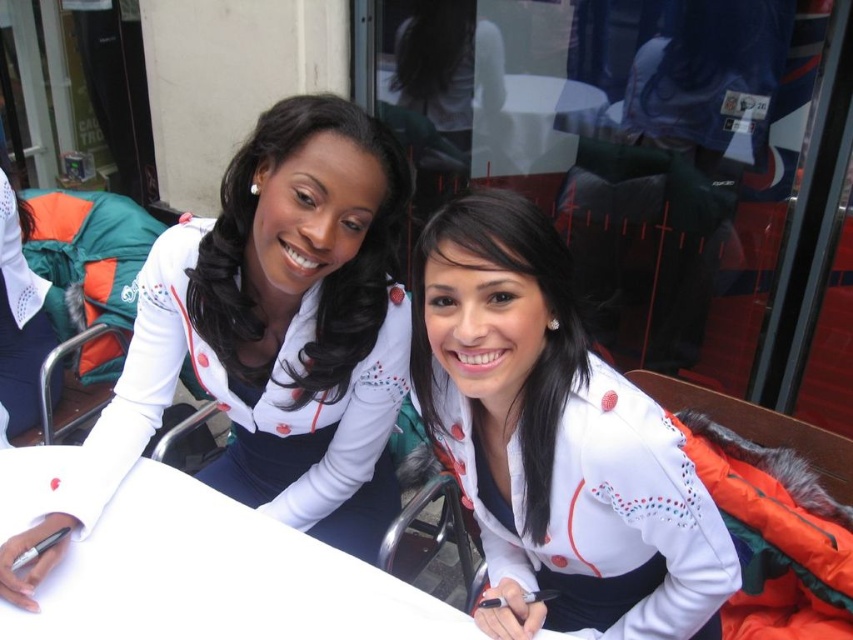
You are designing a poster and want to include both the white matte jacket at upper left and the white paper at center from the image. Which object should you scale up more to make them appear similar in size on the poster?

The white matte jacket at upper left should be scaled up more because its width is less than the white paper at center, so increasing its size will help balance their dimensions on the poster.

You are a photographer at the event and need to capture both white matte jacket at upper left and white matte jacket at center in a single shot. Which jacket should you position closer to the left side of the frame to ensure both are visible?

You should position the white matte jacket at upper left closer to the left side of the frame since it is already to the left of the white matte jacket at center, ensuring both are visible in the shot.